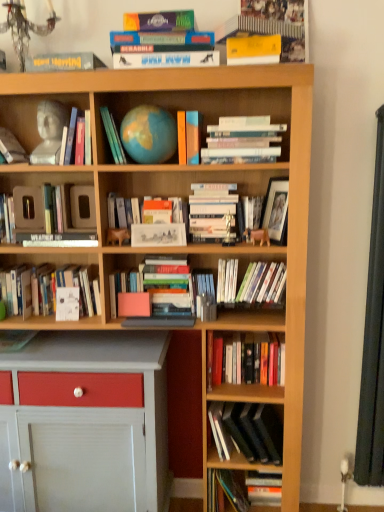
Question: Should I look upward or downward to see matte black book at upper left, the 2th book in the top-to-bottom sequence?

Choices:
 (A) up
 (B) down

Answer: (A)

Question: Is hardcover books at center, which is the 6th book from bottom to top, shorter than hardcover books at center, the 15th book viewed from the top?

Choices:
 (A) no
 (B) yes

Answer: (A)

Question: Is hardcover books at center, the second book in the bottom-to-top sequence, located within hardcover books at center, which is the 6th book from bottom to top?

Choices:
 (A) no
 (B) yes

Answer: (A)

Question: Is hardcover books at center, which is the 6th book from bottom to top, to the left of hardcover books at center, the second book in the bottom-to-top sequence, from the viewer's perspective?

Choices:
 (A) yes
 (B) no

Answer: (A)

Question: Is hardcover books at center, which ranks as the 11th book in top-to-bottom order, turned away from hardcover books at center, the second book in the bottom-to-top sequence?

Choices:
 (A) no
 (B) yes

Answer: (A)

Question: Does hardcover books at center, which is the 6th book from bottom to top, have a larger size compared to hardcover books at center, the second book in the bottom-to-top sequence?

Choices:
 (A) yes
 (B) no

Answer: (B)

Question: From the image's perspective, is hardcover books at center, which is the 6th book from bottom to top, under hardcover books at center, the second book in the bottom-to-top sequence?

Choices:
 (A) no
 (B) yes

Answer: (A)

Question: Is white paperbacks at upper center, the sixth book viewed from the top, smaller than hardcover book at left, the fourth book positioned from the top?

Choices:
 (A) no
 (B) yes

Answer: (A)

Question: Can you confirm if white paperbacks at upper center, acting as the eleventh book starting from the bottom, is positioned to the right of hardcover book at left, the fourth book positioned from the top?

Choices:
 (A) no
 (B) yes

Answer: (B)

Question: Is white paperbacks at upper center, the sixth book viewed from the top, next to hardcover book at left, marked as the 13th book in a bottom-to-top arrangement?

Choices:
 (A) no
 (B) yes

Answer: (A)

Question: Is the position of white paperbacks at upper center, the sixth book viewed from the top, less distant than that of hardcover book at left, marked as the 13th book in a bottom-to-top arrangement?

Choices:
 (A) no
 (B) yes

Answer: (B)

Question: From a real-world perspective, is white paperbacks at upper center, the sixth book viewed from the top, physically above hardcover book at left, the fourth book positioned from the top?

Choices:
 (A) yes
 (B) no

Answer: (B)

Question: From the image's perspective, is white paperbacks at upper center, the sixth book viewed from the top, below hardcover book at left, the fourth book positioned from the top?

Choices:
 (A) yes
 (B) no

Answer: (A)

Question: From the image's perspective, would you say hardcover book at center, the 7th book in the bottom-to-top sequence, is positioned over hardcover book at center, acting as the 5th book starting from the top?

Choices:
 (A) no
 (B) yes

Answer: (A)